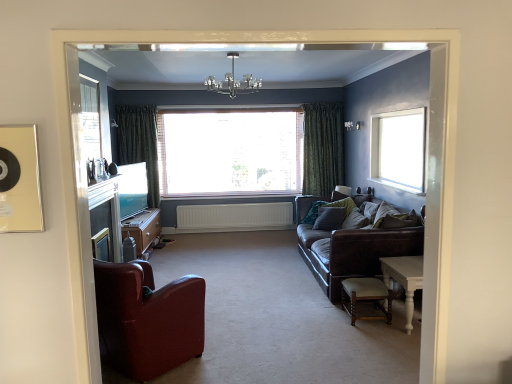
Image resolution: width=512 pixels, height=384 pixels. In order to click on free space in front of light beige leather stool at lower right in this screenshot , I will do `click(373, 338)`.